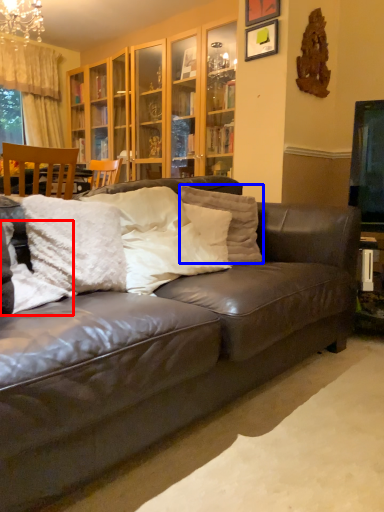
Question: Among these objects, which one is farthest to the camera, pillow (highlighted by a red box) or pillow (highlighted by a blue box)?

Choices:
 (A) pillow
 (B) pillow

Answer: (B)